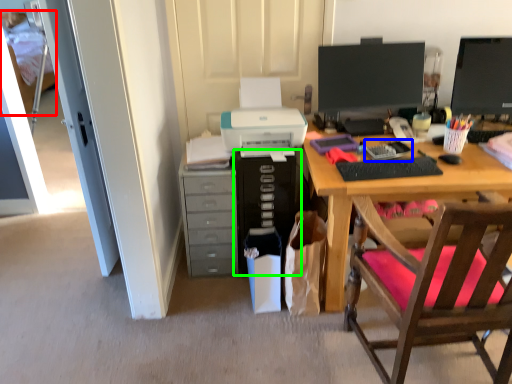
Question: Which is nearer to the bed (highlighted by a red box)? office supplies (highlighted by a blue box) or computer tower (highlighted by a green box).

Choices:
 (A) office supplies
 (B) computer tower

Answer: (B)